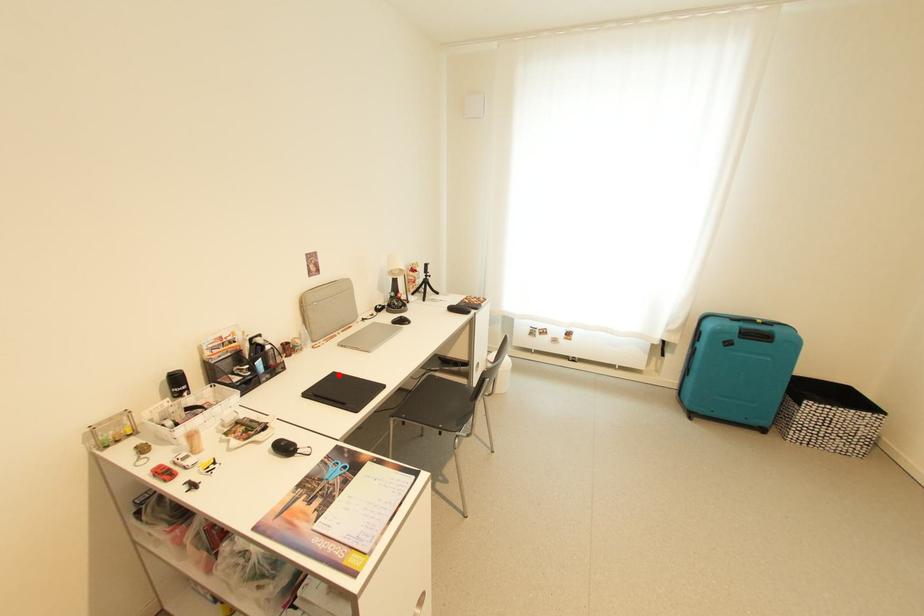
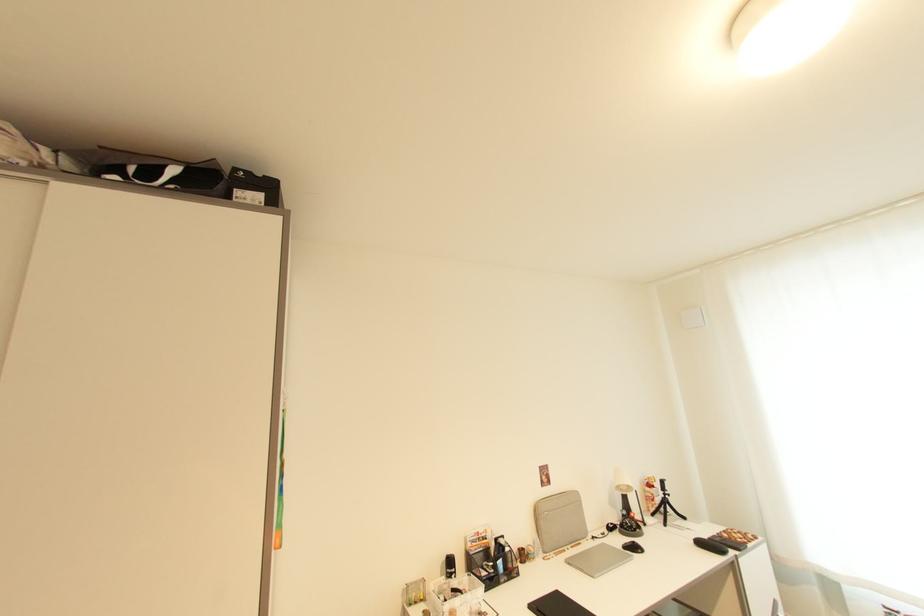
Where in the second image is the point corresponding to the highlighted location from the first image?

(562, 594)